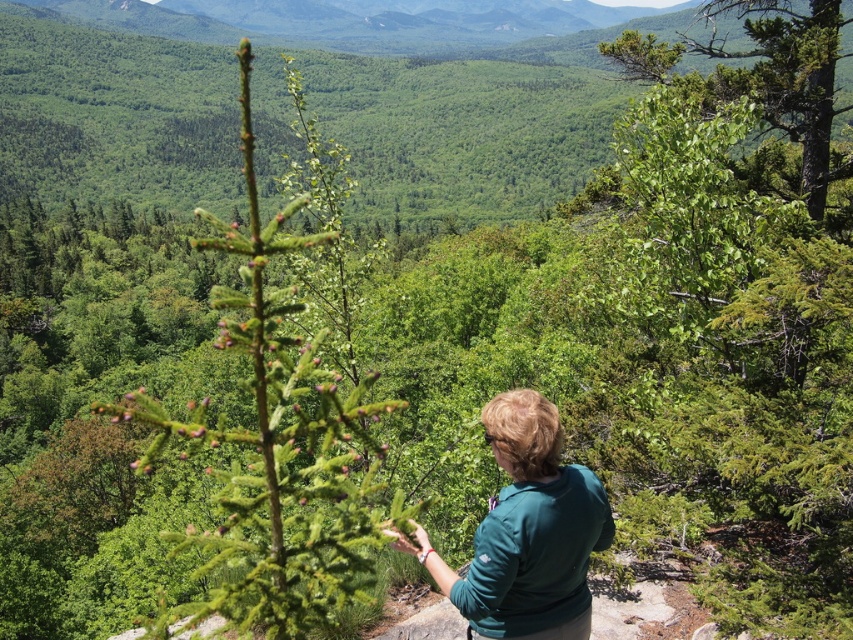
Question: Based on their relative distances, which object is farther from the green matte shirt at center?

Choices:
 (A) green leafy tree at upper right
 (B) green needle-like at center

Answer: (A)

Question: Which point is farther to the camera?

Choices:
 (A) (312, 465)
 (B) (723, 72)
 (C) (444, 573)

Answer: (B)

Question: Which point is farther to the camera?

Choices:
 (A) (819, 182)
 (B) (328, 552)

Answer: (A)

Question: Does green needle-like at center appear on the right side of green matte shirt at center?

Choices:
 (A) yes
 (B) no

Answer: (B)

Question: Is green needle-like at center closer to camera compared to green matte shirt at center?

Choices:
 (A) no
 (B) yes

Answer: (B)

Question: Does green needle-like at center come behind green leafy tree at upper right?

Choices:
 (A) yes
 (B) no

Answer: (B)